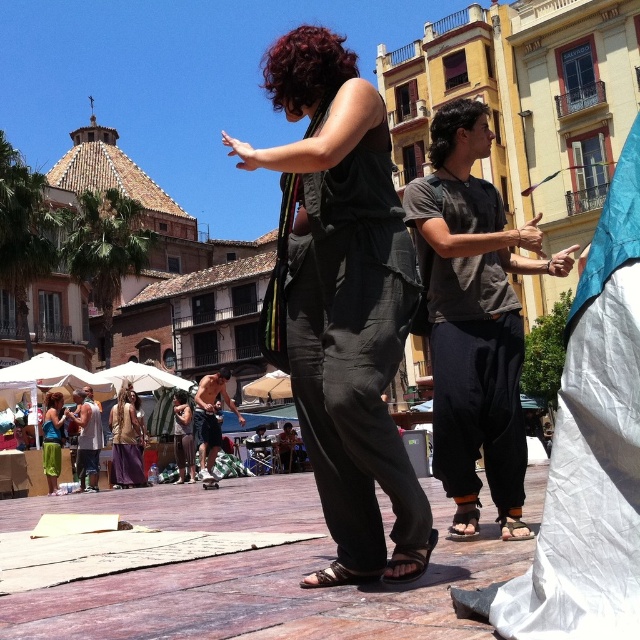
You are organizing a group photo and need to arrange the matte black jumpsuit at center and gray tank top at lower left side by side. Which person should stand on the left to avoid overcrowding the frame?

The matte black jumpsuit at center should stand on the left because it is wider than the gray tank top at lower left, so placing the wider one first will prevent the frame from being too crowded on the right side.

You are a photographer setting up a wide shot of the scene. The dark gray cotton shirt at center and the green fabric skirt at lower left are both in your frame. Based on their sizes in the image, which object would require more space in the composition?

The dark gray cotton shirt at center might require more space in the composition since it might be wider than the green fabric skirt at lower left according to the description.